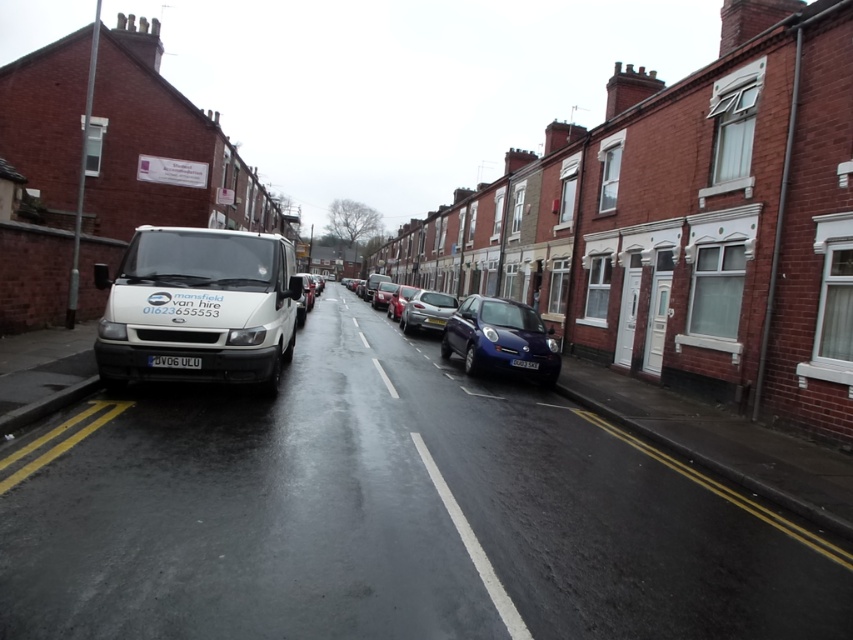
Looking at this image, you are a delivery driver who needs to park your vehicle between two other cars on this residential street. The space available is exactly the width of the black plastic license plate at center. Can your glossy blue hatchback at center fit into this space?

The glossy blue hatchback at center is wider than the black plastic license plate at center, so it cannot fit into the space that is only as wide as the license plate.

You are standing at the point marked by coordinates point (56,440). Looking at the residential street scene, what is the closest object to you among the objects listed below? The objects are the white van parked along the curb and the yellow painted line at lower left.

The yellow painted line at lower left is the closest object to the point (56,440) because the point is on the yellow painted line at lower left.

You are a delivery driver who needs to park your metallic blue hatchback at center in a spot that is marked by the yellow painted line at lower left. Can your vehicle fit within the line?

The metallic blue hatchback at center is wider than the yellow painted line at lower left, so it cannot fit within the line.